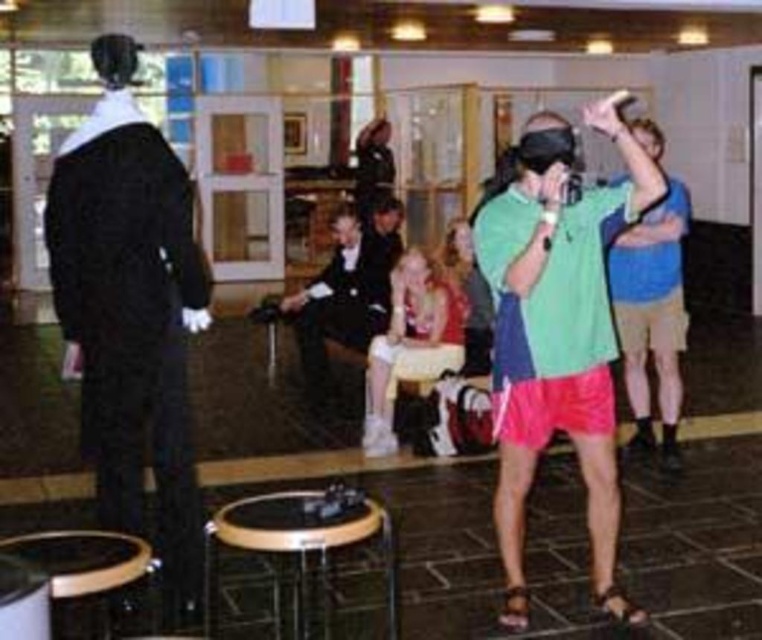
Who is lower down, blue cotton shirt at upper right or matte pink dress at center?

matte pink dress at center

Does blue cotton shirt at upper right appear on the left side of matte pink dress at center?

No, blue cotton shirt at upper right is not to the left of matte pink dress at center.

Who is more distant from viewer, (679,202) or (386,396)?

Positioned behind is point (386,396).

Locate an element on the screen. This screenshot has height=640, width=762. blue cotton shirt at upper right is located at coordinates (652, 316).

At what (x,y) coordinates should I click in order to perform the action: click on black fabric suit at left. Please return your answer as a coordinate pair (x, y). The image size is (762, 640). Looking at the image, I should click on (130, 312).

Between point (155, 225) and point (466, 371), which one is positioned in front?

Point (155, 225) is in front.

Find the location of a particular element. The width and height of the screenshot is (762, 640). black fabric suit at left is located at coordinates (130, 312).

Which is above, black fabric suit at left or black formal suit at center?

Positioned higher is black formal suit at center.

You are a GUI agent. You are given a task and a screenshot of the screen. Output one action in this format:
    pyautogui.click(x=<x>, y=<y>)
    Task: Click on the black fabric suit at left
    Image resolution: width=762 pixels, height=640 pixels.
    Given the screenshot: What is the action you would take?
    pyautogui.click(x=130, y=312)

Where is `black fabric suit at left`? black fabric suit at left is located at coordinates (130, 312).